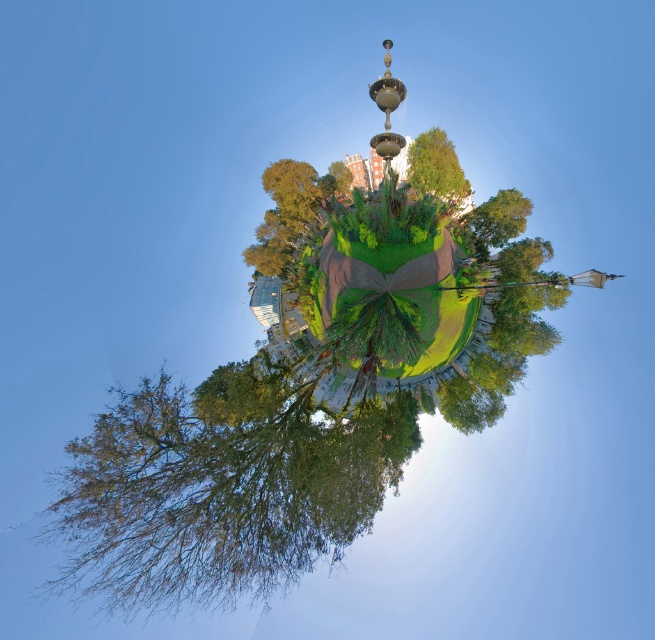
Question: Does green leafy tree at center lie behind polished brass fountain at center?

Choices:
 (A) no
 (B) yes

Answer: (A)

Question: Is green leafy tree at lower left positioned before green leafy tree at upper center?

Choices:
 (A) yes
 (B) no

Answer: (A)

Question: Which is nearer to the polished brass fountain at center?

Choices:
 (A) green leafy tree at upper center
 (B) green leafy tree at center
 (C) green leafy tree at lower left

Answer: (A)

Question: Among these points, which one is nearest to the camera?

Choices:
 (A) (288, 195)
 (B) (272, 476)
 (C) (386, 125)
 (D) (462, 189)

Answer: (B)

Question: Does green leafy tree at center have a greater width compared to green leafy tree at upper center?

Choices:
 (A) no
 (B) yes

Answer: (B)

Question: Which of the following is the farthest from the observer?

Choices:
 (A) (314, 209)
 (B) (369, 88)
 (C) (100, 452)
 (D) (449, 189)

Answer: (B)